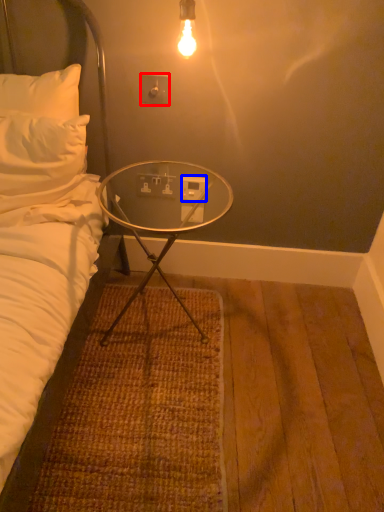
Question: Which of the following is the closest to the observer, electric outlet (highlighted by a red box) or power outlet (highlighted by a blue box)?

Choices:
 (A) electric outlet
 (B) power outlet

Answer: (A)